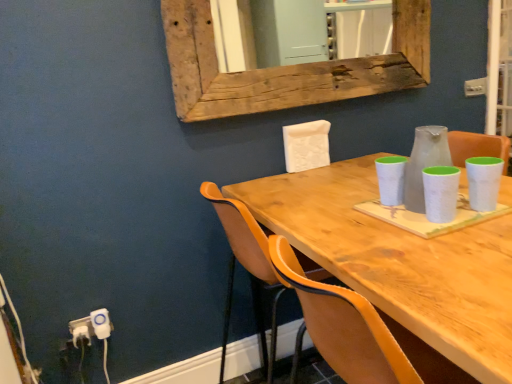
Question: Is white plastic electric outlet at lower left, the 1th electric outlet viewed from the right, at the right side of weathered wood mirror at upper center?

Choices:
 (A) yes
 (B) no

Answer: (B)

Question: Is white plastic electric outlet at lower left, the 1th electric outlet viewed from the right, not close to weathered wood mirror at upper center?

Choices:
 (A) no
 (B) yes

Answer: (B)

Question: Considering the relative sizes of white plastic electric outlet at lower left, the 1th electric outlet viewed from the right, and weathered wood mirror at upper center in the image provided, is white plastic electric outlet at lower left, the 1th electric outlet viewed from the right, smaller than weathered wood mirror at upper center?

Choices:
 (A) yes
 (B) no

Answer: (A)

Question: Is white plastic electric outlet at lower left, which is counted as the 2th electric outlet, starting from the left, closer to camera compared to weathered wood mirror at upper center?

Choices:
 (A) no
 (B) yes

Answer: (A)

Question: From the image's perspective, is white plastic electric outlet at lower left, which is counted as the 2th electric outlet, starting from the left, below weathered wood mirror at upper center?

Choices:
 (A) no
 (B) yes

Answer: (B)

Question: From the image's perspective, is weathered wood mirror at upper center located above or below white plastic electric outlet at lower left, arranged as the 1th electric outlet when viewed from the left?

Choices:
 (A) below
 (B) above

Answer: (B)

Question: Considering the positions of weathered wood mirror at upper center and white plastic electric outlet at lower left, arranged as the 1th electric outlet when viewed from the left, in the image, is weathered wood mirror at upper center taller or shorter than white plastic electric outlet at lower left, arranged as the 1th electric outlet when viewed from the left,?

Choices:
 (A) short
 (B) tall

Answer: (B)

Question: Is weathered wood mirror at upper center inside or outside of white plastic electric outlet at lower left, which is the 2th electric outlet in right-to-left order?

Choices:
 (A) outside
 (B) inside

Answer: (A)

Question: Looking at the image, does weathered wood mirror at upper center seem bigger or smaller compared to white plastic electric outlet at lower left, arranged as the 1th electric outlet when viewed from the left?

Choices:
 (A) big
 (B) small

Answer: (A)

Question: Considering the positions of orange leather chair at center and white plastic electric outlet at lower left, which is the 2th electric outlet in right-to-left order, in the image, is orange leather chair at center wider or thinner than white plastic electric outlet at lower left, which is the 2th electric outlet in right-to-left order,?

Choices:
 (A) thin
 (B) wide

Answer: (B)

Question: From the image's perspective, is orange leather chair at center located above or below white plastic electric outlet at lower left, which is the 2th electric outlet in right-to-left order?

Choices:
 (A) above
 (B) below

Answer: (A)

Question: In the image, is orange leather chair at center positioned in front of or behind white plastic electric outlet at lower left, arranged as the 1th electric outlet when viewed from the left?

Choices:
 (A) behind
 (B) front

Answer: (B)

Question: From a real-world perspective, is orange leather chair at center physically located above or below white plastic electric outlet at lower left, which is the 2th electric outlet in right-to-left order?

Choices:
 (A) above
 (B) below

Answer: (A)

Question: From a real-world perspective, is white plastic electric outlet at lower left, which is the 2th electric outlet in right-to-left order, above or below wooden table at center?

Choices:
 (A) above
 (B) below

Answer: (B)

Question: Does point (70, 327) appear closer or farther from the camera than point (378, 288)?

Choices:
 (A) farther
 (B) closer

Answer: (A)